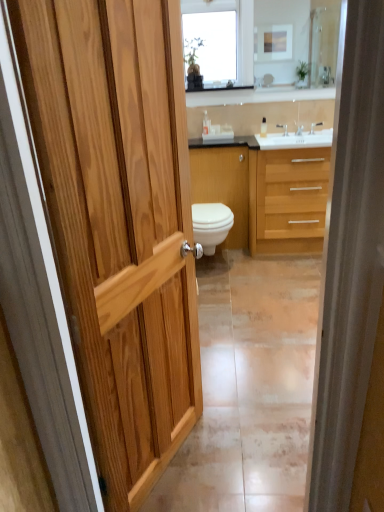
Question: From a real-world perspective, is white glossy cabinet at center above or below light wood/woodenmaterial/texture bathroom cabinet at center?

Choices:
 (A) above
 (B) below

Answer: (A)

Question: Relative to light wood/woodenmaterial/texture bathroom cabinet at center, is white glossy cabinet at center in front or behind?

Choices:
 (A) front
 (B) behind

Answer: (B)

Question: Which is farther from the clear glass mirror at upper center?

Choices:
 (A) silver metallic faucet at upper center
 (B) light wood/woodenmaterial/texture bathroom cabinet at center
 (C) white glossy toilet at center
 (D) clear glass window at upper center
 (E) white glossy cabinet at center

Answer: (C)

Question: Which is farther from the clear glass window at upper center?

Choices:
 (A) clear glass mirror at upper center
 (B) silver metallic faucet at upper center
 (C) white glossy cabinet at center
 (D) white glossy toilet at center
 (E) light wood/woodenmaterial/texture bathroom cabinet at center

Answer: (D)